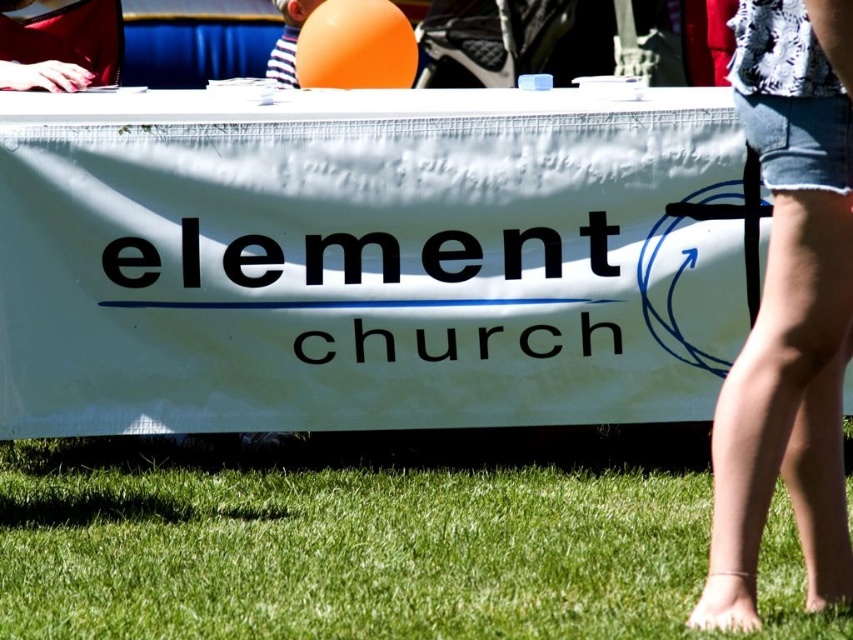
The height and width of the screenshot is (640, 853). Describe the element at coordinates (357, 534) in the screenshot. I see `green grass at lower center` at that location.

Looking at this image, does green grass at lower center have a lesser width compared to denim shorts at lower right?

In fact, green grass at lower center might be wider than denim shorts at lower right.

Is point (222, 512) in front of point (788, 115)?

No, (222, 512) is further to viewer.

I want to click on green grass at lower center, so click(357, 534).